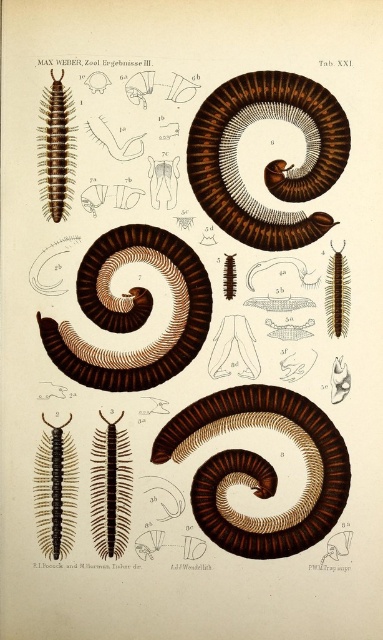
Is black matte centipede at left positioned at the back of black matte centipede at center?

No.

Can you confirm if black matte centipede at left is positioned to the right of black matte centipede at center?

In fact, black matte centipede at left is to the left of black matte centipede at center.

The image size is (383, 640). I want to click on black matte centipede at left, so click(x=55, y=490).

This screenshot has height=640, width=383. Identify the location of black matte centipede at left. (55, 490).

Which of these two, brown matte centipede at center or black matte centipede at center, stands taller?

With more height is brown matte centipede at center.

The width and height of the screenshot is (383, 640). What do you see at coordinates (132, 310) in the screenshot?
I see `brown matte centipede at center` at bounding box center [132, 310].

Is point (132, 320) positioned behind point (114, 515)?

Yes, it is.

Where is `brown matte centipede at center`? brown matte centipede at center is located at coordinates (132, 310).

Who is more distant from viewer, (x=225, y=93) or (x=62, y=160)?

The point (x=62, y=160) is more distant.

Can you confirm if brown matte centipede at upper center is wider than brown matte centipede at left?

Indeed, brown matte centipede at upper center has a greater width compared to brown matte centipede at left.

Is point (206, 160) positioned behind point (50, 70)?

That is True.

I want to click on brown matte centipede at upper center, so click(x=268, y=163).